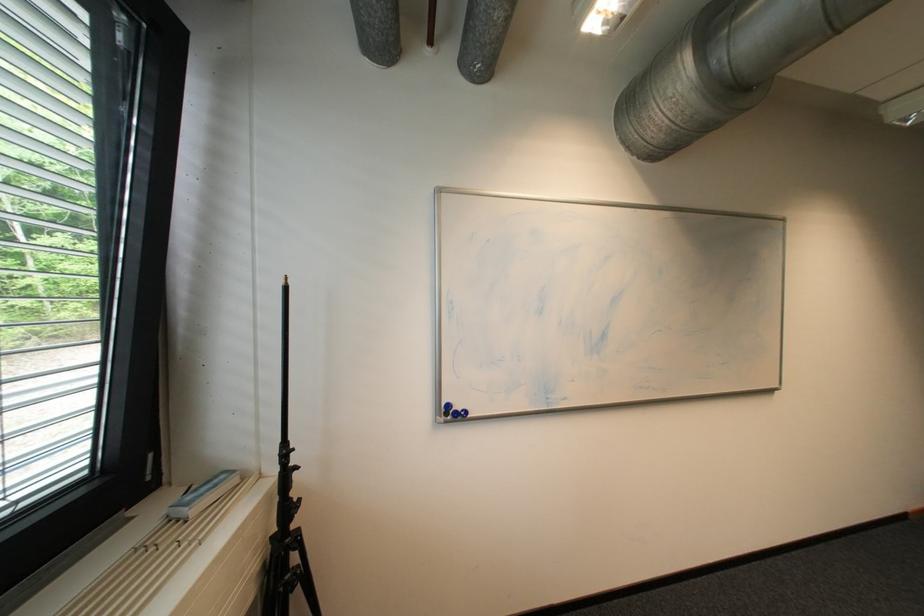
What do you see at coordinates (148, 573) in the screenshot?
I see `the black window handle` at bounding box center [148, 573].